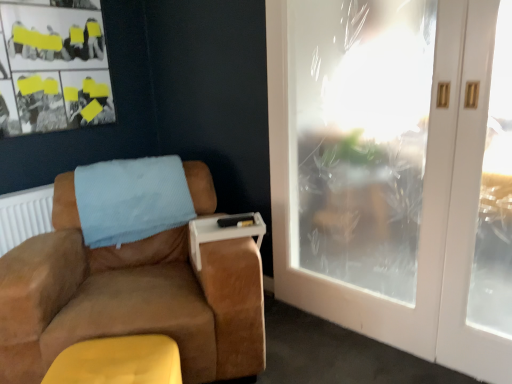
Question: Can you confirm if suede brown armchair at left is smaller than white plastic tray at armrest?

Choices:
 (A) yes
 (B) no

Answer: (B)

Question: Is suede brown armchair at left aimed at white plastic tray at armrest?

Choices:
 (A) no
 (B) yes

Answer: (A)

Question: Is suede brown armchair at left with white plastic tray at armrest?

Choices:
 (A) yes
 (B) no

Answer: (B)

Question: Does suede brown armchair at left contain white plastic tray at armrest?

Choices:
 (A) no
 (B) yes

Answer: (B)

Question: From a real-world perspective, is suede brown armchair at left on top of white plastic tray at armrest?

Choices:
 (A) no
 (B) yes

Answer: (A)

Question: From the image's perspective, is light blue textured blanket at upper left located above or below white frosted glass door at right?

Choices:
 (A) above
 (B) below

Answer: (B)

Question: From their relative heights in the image, would you say light blue textured blanket at upper left is taller or shorter than white frosted glass door at right?

Choices:
 (A) tall
 (B) short

Answer: (B)

Question: Considering the positions of light blue textured blanket at upper left and white frosted glass door at right in the image, is light blue textured blanket at upper left bigger or smaller than white frosted glass door at right?

Choices:
 (A) big
 (B) small

Answer: (B)

Question: Is point (121, 213) positioned closer to the camera than point (457, 200)?

Choices:
 (A) closer
 (B) farther

Answer: (B)

Question: From the image's perspective, is yellow suede footrest at lower left located above or below light blue textured blanket at upper left?

Choices:
 (A) above
 (B) below

Answer: (B)

Question: Would you say yellow suede footrest at lower left is to the left or to the right of light blue textured blanket at upper left in the picture?

Choices:
 (A) left
 (B) right

Answer: (B)

Question: Is yellow suede footrest at lower left taller or shorter than light blue textured blanket at upper left?

Choices:
 (A) short
 (B) tall

Answer: (A)

Question: Is yellow suede footrest at lower left bigger or smaller than light blue textured blanket at upper left?

Choices:
 (A) small
 (B) big

Answer: (A)

Question: Would you say suede brown armchair at left is to the left or to the right of light blue textured blanket at upper left in the picture?

Choices:
 (A) right
 (B) left

Answer: (A)

Question: Considering the positions of suede brown armchair at left and light blue textured blanket at upper left in the image, is suede brown armchair at left bigger or smaller than light blue textured blanket at upper left?

Choices:
 (A) big
 (B) small

Answer: (A)